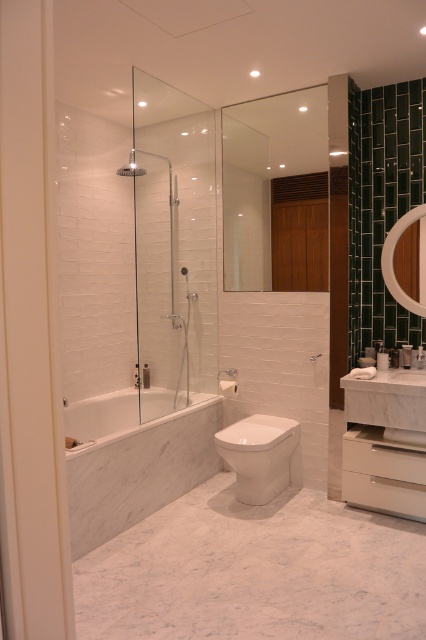
Question: Which point is closer to the camera?

Choices:
 (A) white marble sink at center
 (B) white glossy vanity at lower right
 (C) transparent glass shower door at center
 (D) matte glass shower at upper center

Answer: (A)

Question: Estimate the real-world distances between objects in this image. Which object is closer to the white glossy toilet at lower center?

Choices:
 (A) white marble bathtub at lower left
 (B) white glossy vanity at lower right

Answer: (B)

Question: Observing the image, what is the correct spatial positioning of white glossy toilet at lower center in reference to matte brown mirror at upper right?

Choices:
 (A) right
 (B) left

Answer: (B)

Question: Can you confirm if white glossy vanity at lower right is bigger than white glossy toilet at lower center?

Choices:
 (A) yes
 (B) no

Answer: (A)

Question: Which of the following is the closest to the observer?

Choices:
 (A) white marble sink at center
 (B) transparent glass shower door at center
 (C) matte brown mirror at upper right
 (D) matte glass shower at upper center

Answer: (A)

Question: Is transparent glass shower door at center to the left of white marble bathtub at lower left from the viewer's perspective?

Choices:
 (A) yes
 (B) no

Answer: (B)